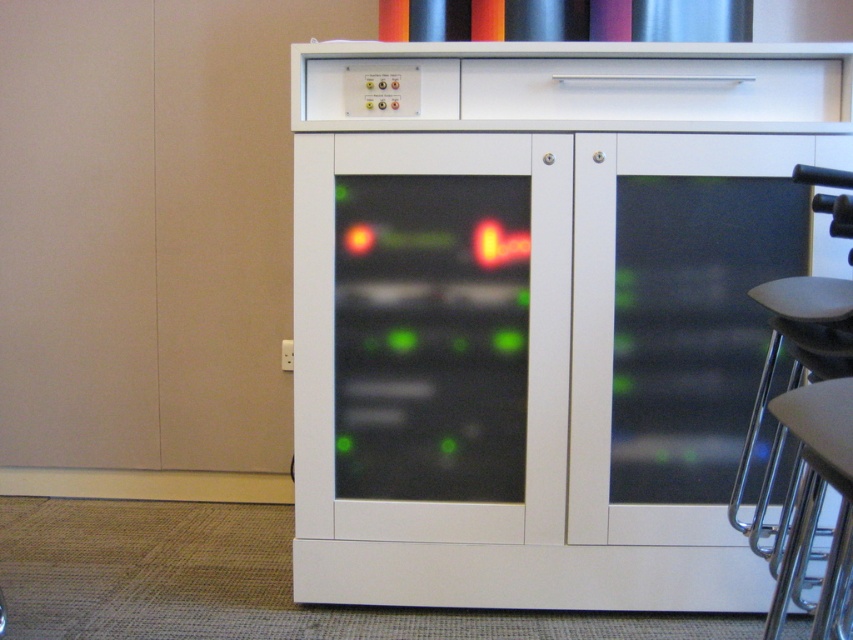
Based on the photo, you are sitting on the metallic gray seat at right and want to reach the control panel on the white glossy cabinet at center. Can you comfortably reach it without standing up?

The white glossy cabinet at center is located above the metallic gray seat at right, so if you are sitting on the metallic gray seat at right, you might not be able to comfortably reach the control panel on the white glossy cabinet at center without standing up because it is positioned higher than the seat.

Consider the image. You are a technician inspecting the equipment inside the white cabinet. You notice two points marked as point 1 and point 2. Point 1 is at coordinates point (569, 339) and point 2 is at point (805, 477). Which point is closer to you when you are standing in front of the cabinet?

Point (569, 339) is closer to you than point (805, 477) because it is further to the viewer according to the description.

You are an engineer who needs to move the white glossy cabinet at center and the metallic gray seat at right to a smaller room. Based on their sizes, which object would be easier to fit through a standard doorway?

The white glossy cabinet at center occupies less space than the metallic gray seat at right, so it would be easier to fit through a standard doorway.